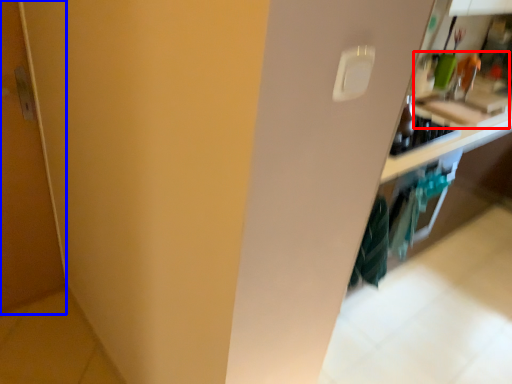
Question: Among these objects, which one is nearest to the camera, sink (highlighted by a red box) or door (highlighted by a blue box)?

Choices:
 (A) sink
 (B) door

Answer: (B)